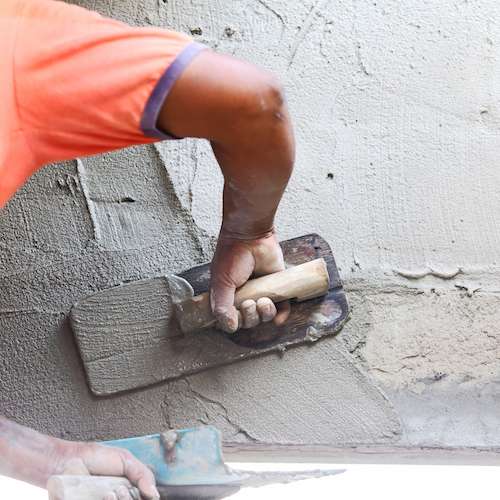
Locate an element on the screen. uncovered wall is located at coordinates (405, 329).